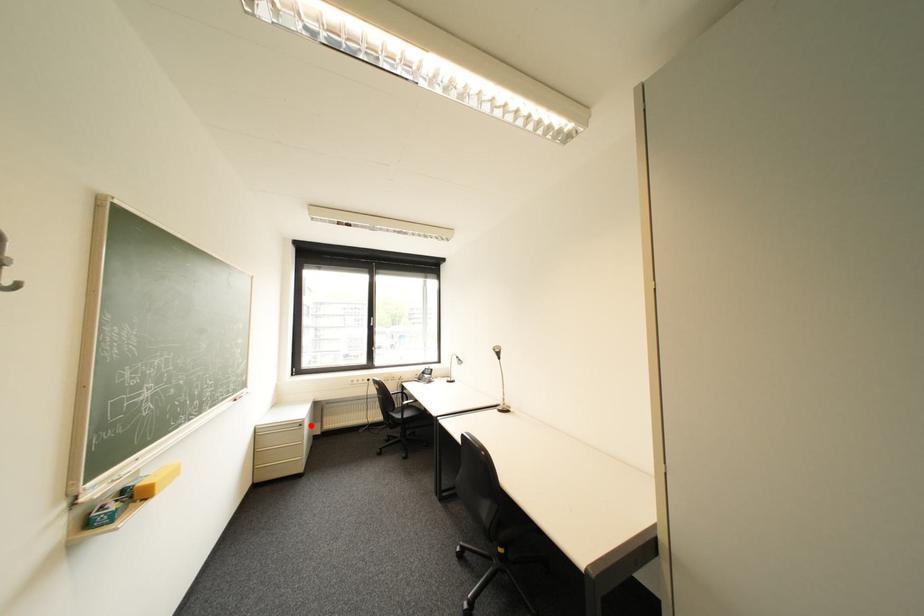
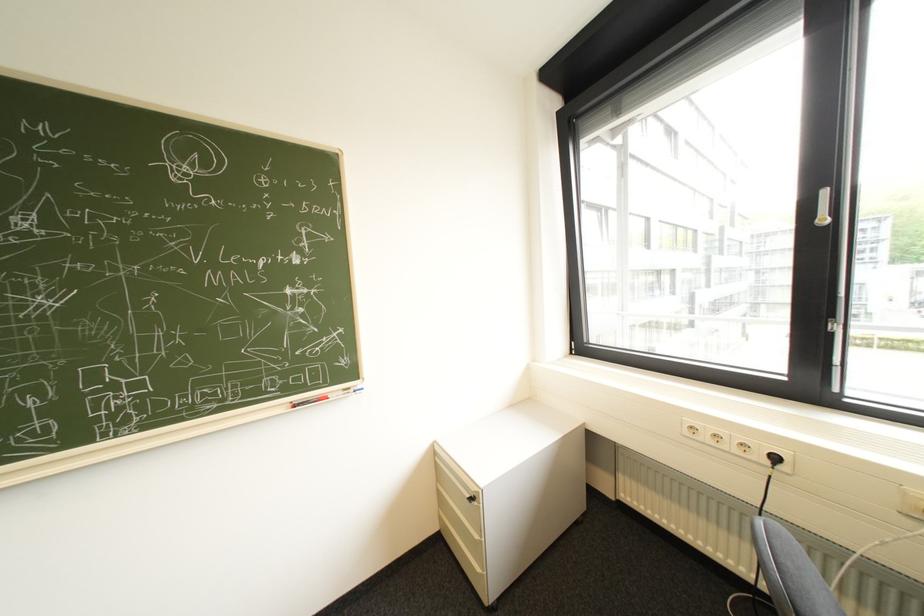
Question: I am providing you with two images of the same scene from different viewpoints. Given a red point in image1, look at the same physical point in image2. Is it:

Choices:
 (A) Closer to the viewpoint
 (B) Farther from the viewpoint

Answer: (B)